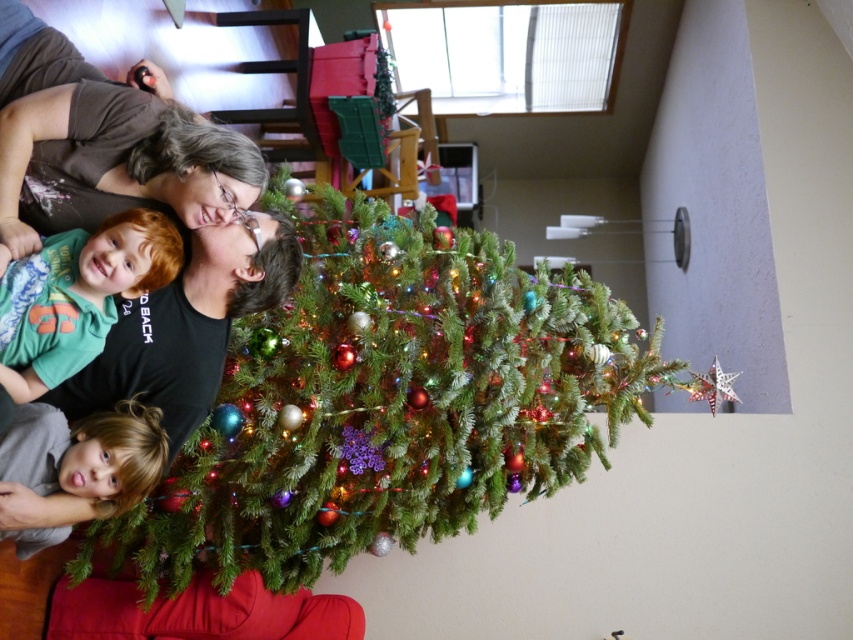
You are planning to take a photo of the green matte shirt at left and the blonde hair at lower left. Which object appears narrower in the photo?

The green matte shirt at left appears narrower than the blonde hair at lower left in the photo.